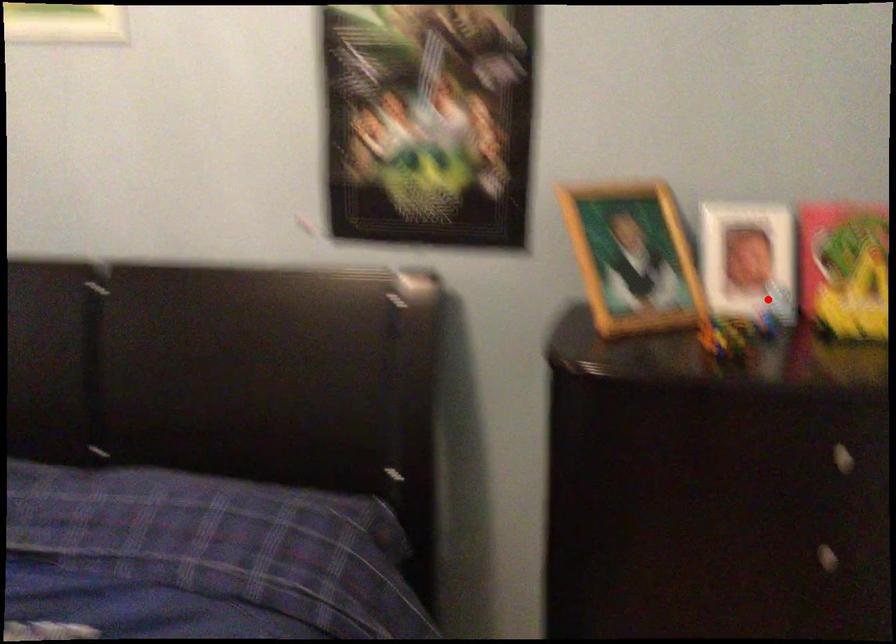
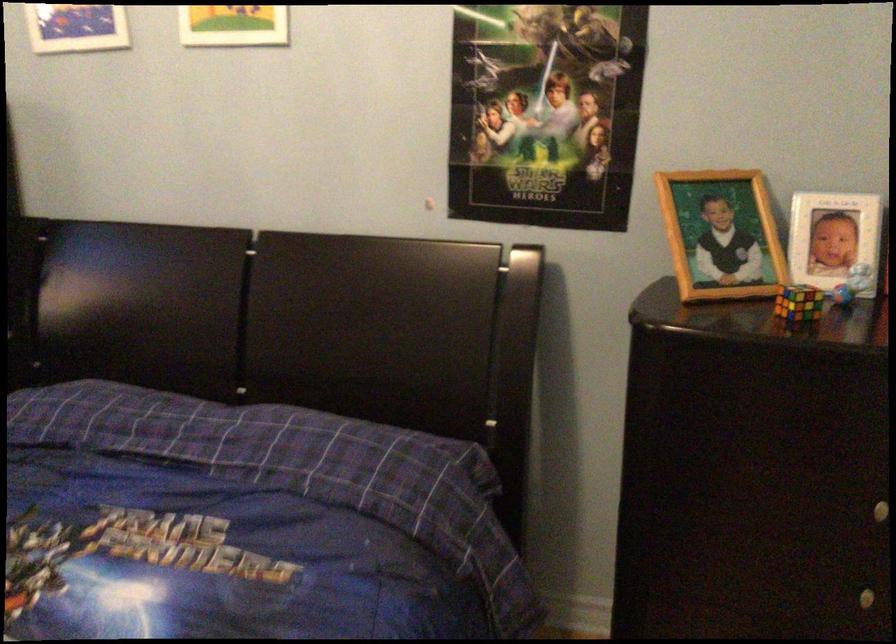
Locate, in the second image, the point that corresponds to the highlighted location in the first image.

(851, 283)